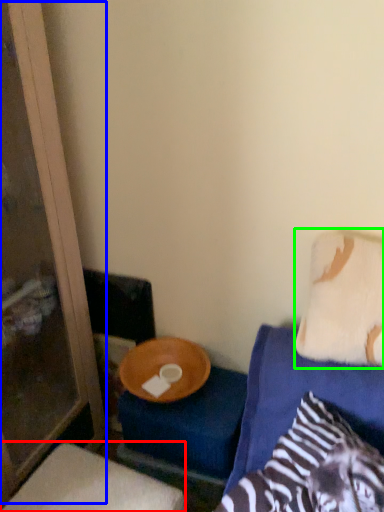
Question: Which is farther away from furniture (highlighted by a red box)? screen door (highlighted by a blue box) or pillow (highlighted by a green box)?

Choices:
 (A) screen door
 (B) pillow

Answer: (B)